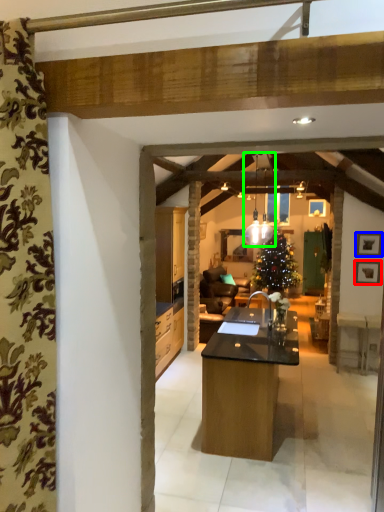
Question: Considering the real-world distances, which object is farthest from picture frame (highlighted by a red box)? picture frame (highlighted by a blue box) or light fixture (highlighted by a green box)?

Choices:
 (A) picture frame
 (B) light fixture

Answer: (B)